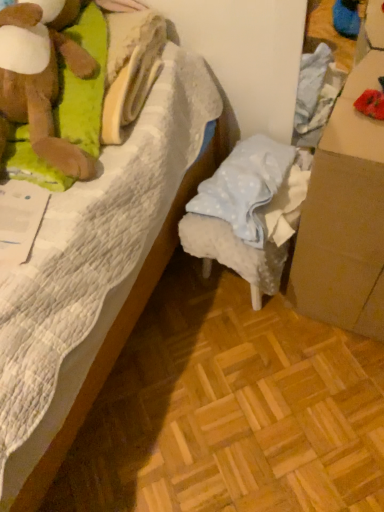
Question: Considering the relative positions of brown cardboard box at right and light blue fabric stool at center in the image provided, is brown cardboard box at right behind light blue fabric stool at center?

Choices:
 (A) yes
 (B) no

Answer: (B)

Question: From a real-world perspective, is brown cardboard box at right over light blue fabric stool at center?

Choices:
 (A) no
 (B) yes

Answer: (B)

Question: Can you confirm if brown cardboard box at right is thinner than light blue fabric stool at center?

Choices:
 (A) no
 (B) yes

Answer: (B)

Question: Does brown cardboard box at right have a smaller size compared to light blue fabric stool at center?

Choices:
 (A) yes
 (B) no

Answer: (B)

Question: Does brown cardboard box at right turn towards light blue fabric stool at center?

Choices:
 (A) yes
 (B) no

Answer: (B)

Question: From the image's perspective, relative to brown cardboard box at right, is white quilted bed at center above or below?

Choices:
 (A) above
 (B) below

Answer: (A)

Question: Is white quilted bed at center wider or thinner than brown cardboard box at right?

Choices:
 (A) wide
 (B) thin

Answer: (A)

Question: Is white quilted bed at center in front of or behind brown cardboard box at right in the image?

Choices:
 (A) behind
 (B) front

Answer: (B)

Question: Considering the positions of white quilted bed at center and brown cardboard box at right in the image, is white quilted bed at center taller or shorter than brown cardboard box at right?

Choices:
 (A) short
 (B) tall

Answer: (B)

Question: In terms of height, does light blue fabric stool at center look taller or shorter compared to brown cardboard box at right?

Choices:
 (A) short
 (B) tall

Answer: (A)

Question: Is light blue fabric stool at center bigger or smaller than brown cardboard box at right?

Choices:
 (A) small
 (B) big

Answer: (A)

Question: In the image, is light blue fabric stool at center on the left side or the right side of brown cardboard box at right?

Choices:
 (A) left
 (B) right

Answer: (A)

Question: Choose the correct answer: Is light blue fabric stool at center inside brown cardboard box at right or outside it?

Choices:
 (A) inside
 (B) outside

Answer: (B)

Question: Considering the positions of brown cardboard box at right and white quilted bed at center in the image, is brown cardboard box at right bigger or smaller than white quilted bed at center?

Choices:
 (A) small
 (B) big

Answer: (A)

Question: Is brown cardboard box at right situated inside white quilted bed at center or outside?

Choices:
 (A) outside
 (B) inside

Answer: (A)